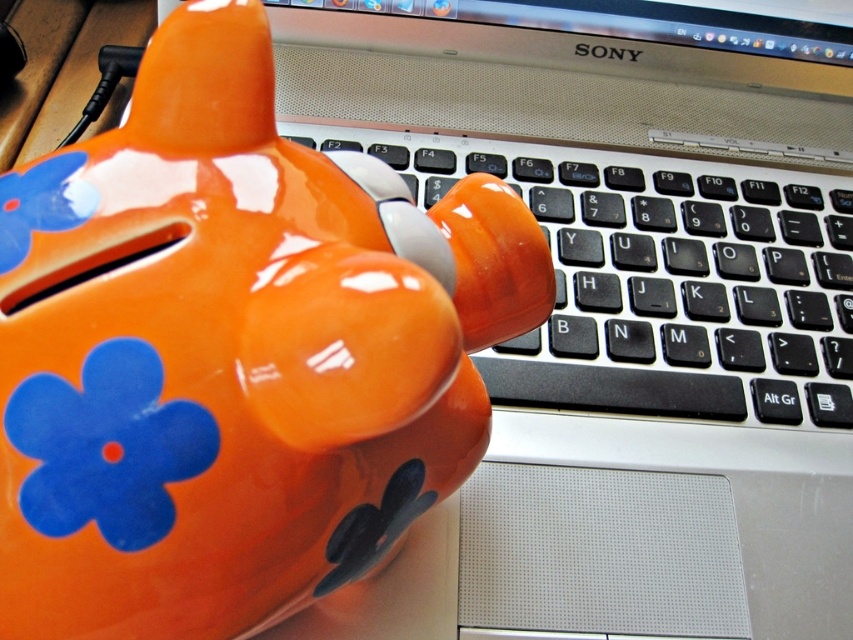
Question: Which of the following is the farthest from the observer?

Choices:
 (A) (585, 173)
 (B) (25, 522)

Answer: (A)

Question: Can you confirm if glossy ceramic piggy bank at upper left is positioned below black plastic keyboard at center?

Choices:
 (A) yes
 (B) no

Answer: (A)

Question: Among these objects, which one is farthest from the camera?

Choices:
 (A) glossy ceramic piggy bank at upper left
 (B) black plastic keyboard at center

Answer: (B)

Question: Is glossy ceramic piggy bank at upper left further to the viewer compared to black plastic keyboard at center?

Choices:
 (A) yes
 (B) no

Answer: (B)

Question: Among these objects, which one is nearest to the camera?

Choices:
 (A) glossy ceramic piggy bank at upper left
 (B) black plastic keyboard at center

Answer: (A)

Question: Is glossy ceramic piggy bank at upper left to the right of black plastic keyboard at center from the viewer's perspective?

Choices:
 (A) no
 (B) yes

Answer: (A)